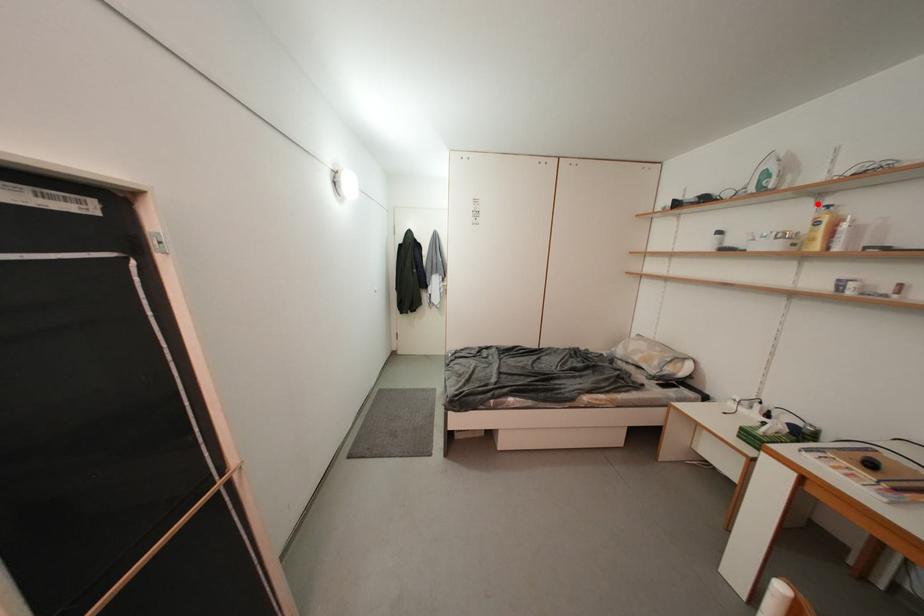
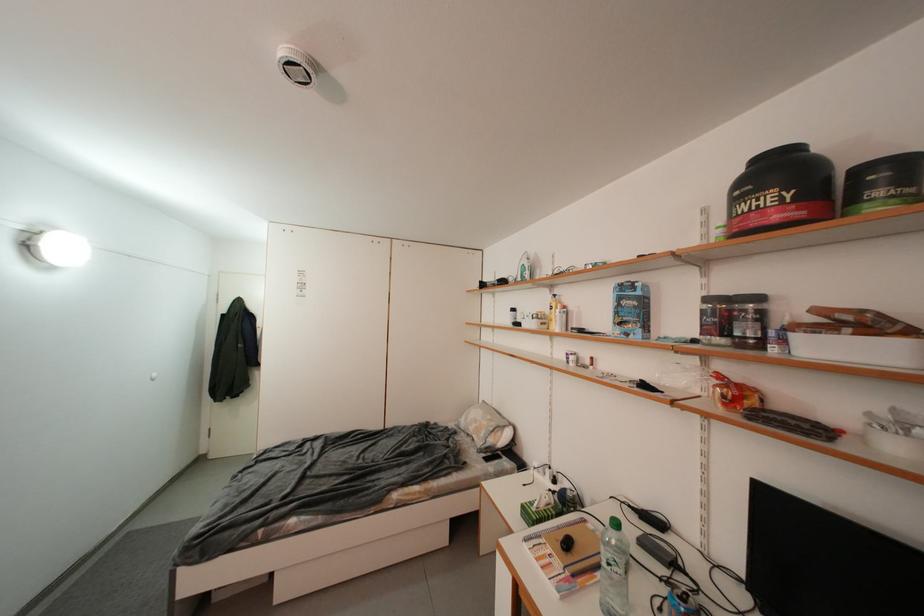
In the second image, find the point that corresponds to the highlighted location in the first image.

(554, 294)